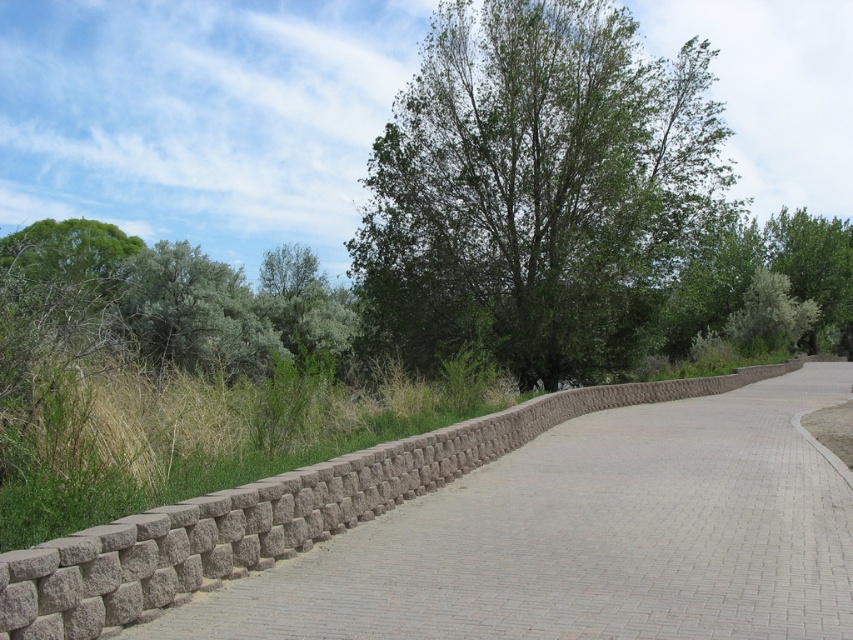
You are a gardener who needs to trim the green leafy shrub at left so that it doesn not block the view of the brown brick pavement at center. Based on their heights, is it possible to achieve this by trimming the shrub?

The brown brick pavement at center has a lesser height compared to green leafy shrub at left, so trimming the green leafy shrub at left would allow the pavement to be visible as the shrub is taller.

You are standing at the starting point of the pathway and want to reach a destination located at point (x=831, y=280). There is another point at (x=691, y=180) along the way. According to the scene description, which point will you encounter first while walking towards your destination?

You will encounter point (x=691, y=180) first because it is in front of point (x=831, y=280) along the path.